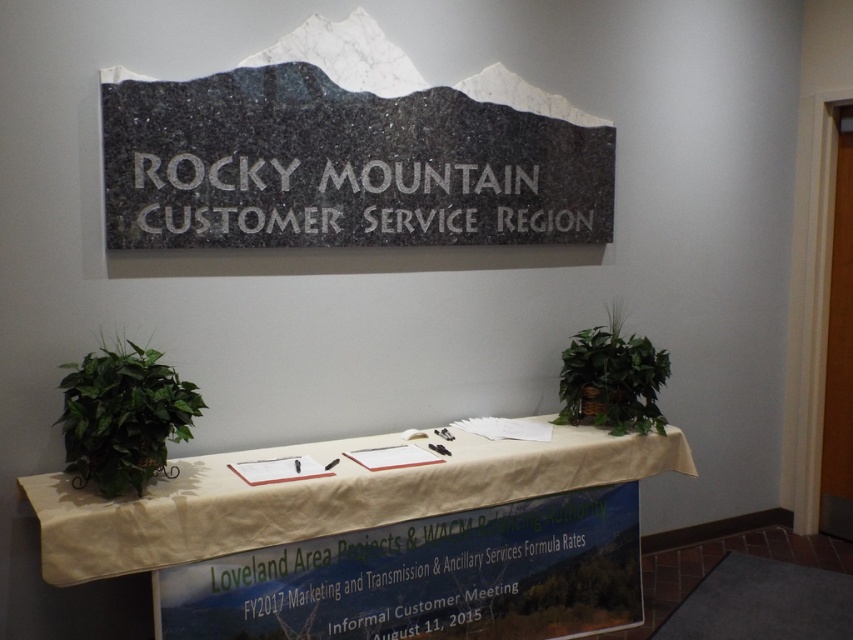
Question: Which point is closer to the camera taking this photo?

Choices:
 (A) (265, 182)
 (B) (567, 417)

Answer: (A)

Question: Among these objects, which one is farthest from the camera?

Choices:
 (A) green leafy plant at left
 (B) granite sign at center

Answer: (B)

Question: Among these objects, which one is nearest to the camera?

Choices:
 (A) green leafy plant at left
 (B) granite sign at center

Answer: (A)

Question: Can you confirm if white engraved text at center is positioned above green leafy plant at center?

Choices:
 (A) no
 (B) yes

Answer: (B)

Question: Does granite sign at center come in front of green leafy plant at left?

Choices:
 (A) yes
 (B) no

Answer: (B)

Question: Is white engraved text at center behind green leafy plant at center?

Choices:
 (A) no
 (B) yes

Answer: (A)